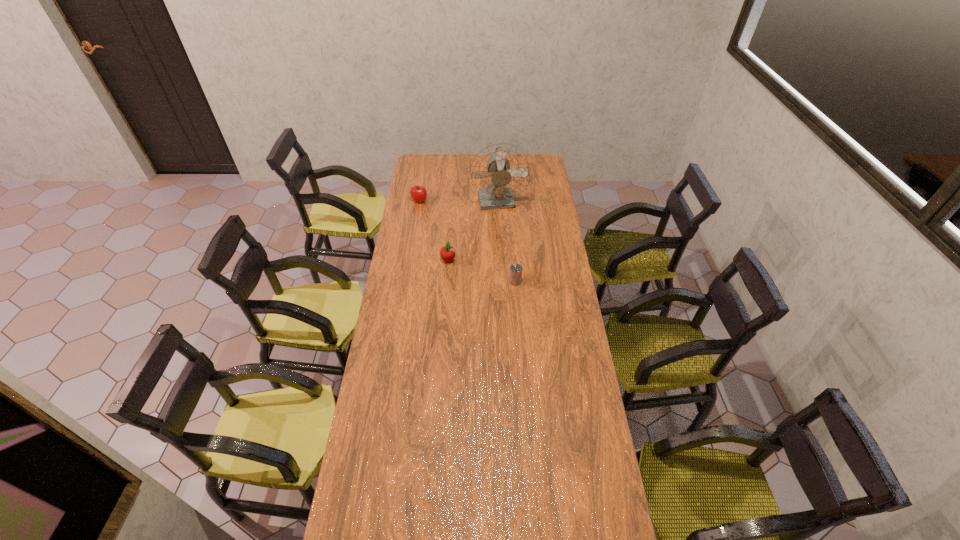
Image resolution: width=960 pixels, height=540 pixels. Find the location of `fan`. fan is located at coordinates (499, 172).

This screenshot has height=540, width=960. Find the location of `the left apple`. the left apple is located at coordinates (418, 193).

Identify the location of the farther apple. This screenshot has height=540, width=960. (418, 193).

At what (x,y) coordinates should I click in order to perform the action: click on the second object from left to right. Please return your answer as a coordinate pair (x, y). This screenshot has width=960, height=540. Looking at the image, I should click on (447, 253).

Where is `the third farthest object`? the third farthest object is located at coordinates (447, 253).

This screenshot has width=960, height=540. Find the location of `the nearest object`. the nearest object is located at coordinates (515, 276).

Identify the location of free space located 0.100m in front of the tallest object to blow air. click(499, 229).

Where is `vacant region located 0.150m on the right of the leftmost object`? vacant region located 0.150m on the right of the leftmost object is located at coordinates (453, 201).

The width and height of the screenshot is (960, 540). Identify the location of vacant space located on the right of the second nearest object. (497, 260).

You are a GUI agent. You are given a task and a screenshot of the screen. Output one action in this format:
    pyautogui.click(x=<x>, y=<y>)
    Task: Click on the free spot located 0.390m on the left of the beer can
    
    Given the screenshot: What is the action you would take?
    pyautogui.click(x=428, y=281)